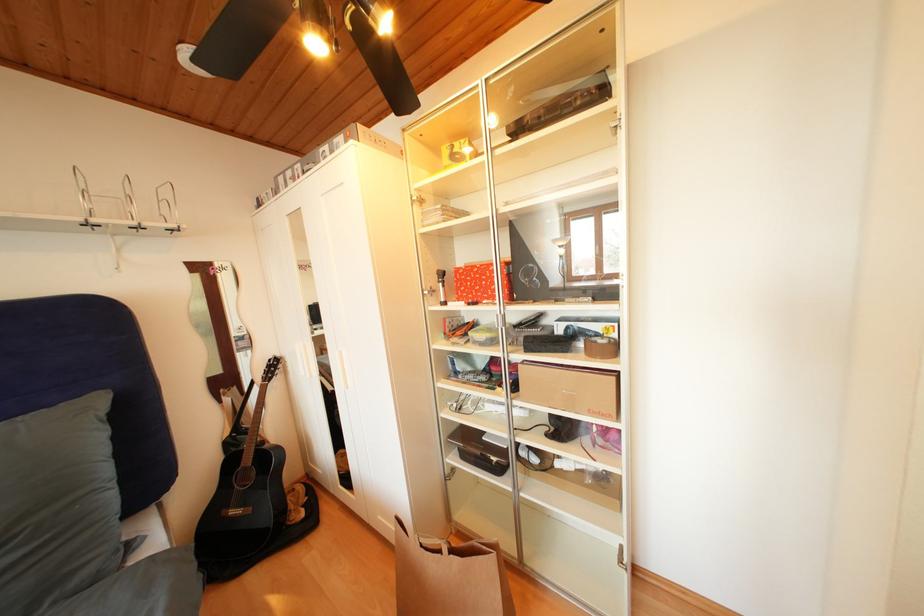
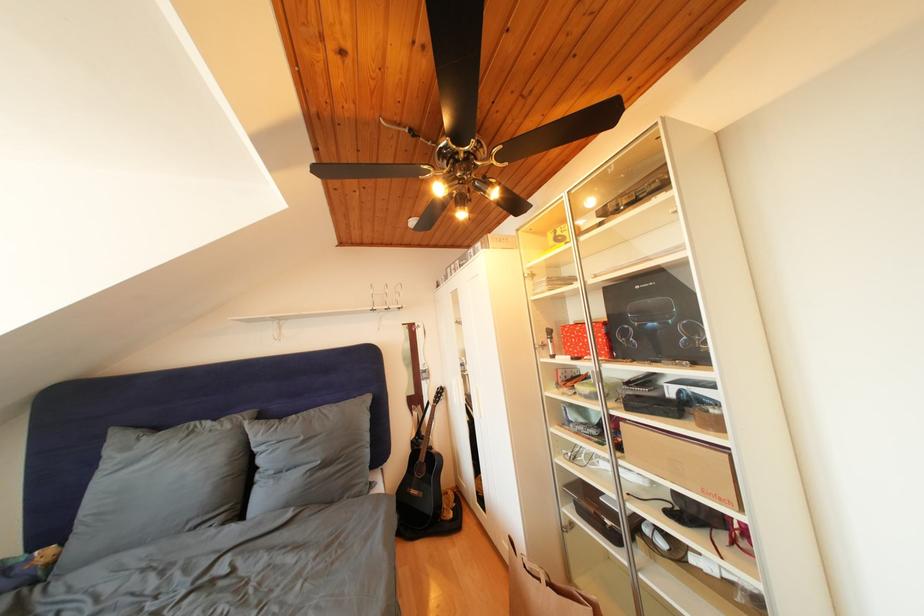
Find the pixel in the second image that matches point (502, 545) in the first image.

(602, 602)